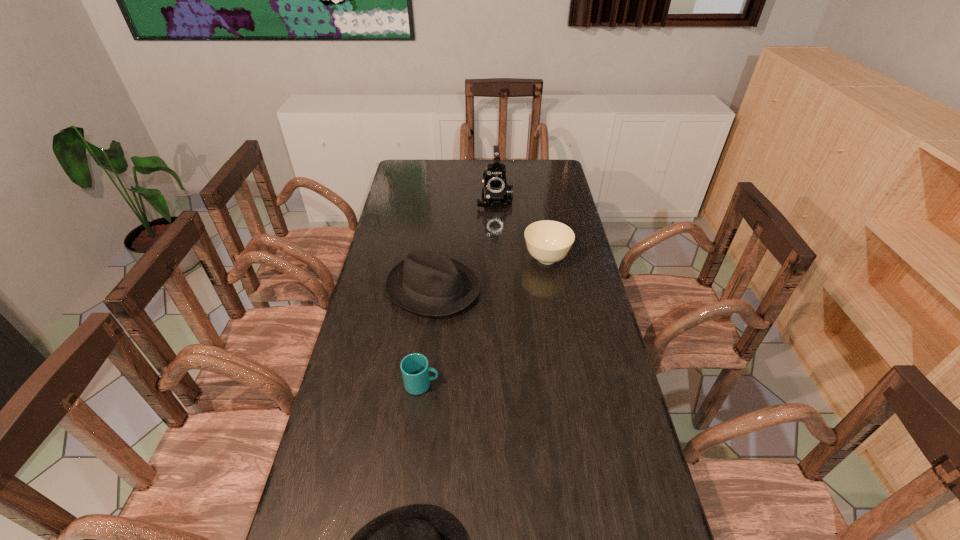
This screenshot has width=960, height=540. I want to click on unoccupied position between the cup and the third tallest object, so 484,321.

Where is `free space between the fourth shortest object and the cup`? The image size is (960, 540). free space between the fourth shortest object and the cup is located at coordinates (427, 336).

Find the location of a particular element. vacant space that's between the taller fedora and the camcorder is located at coordinates (464, 244).

Image resolution: width=960 pixels, height=540 pixels. Find the location of `object that is the closest to the nearest object`. object that is the closest to the nearest object is located at coordinates (415, 369).

Identify which object is located as the nearest to the third tallest object. Please provide its 2D coordinates. Your answer should be formatted as a tuple, i.e. [(x, y)], where the tuple contains the x and y coordinates of a point satisfying the conditions above.

[(427, 281)]

I want to click on free region that satisfies the following two spatial constraints: 1. on the lens mount of the tallest object; 2. on the right side of the rightmost object, so click(497, 259).

Where is `vacant position in the image that satisfies the following two spatial constraints: 1. on the lens mount of the camcorder; 2. on the left side of the third shortest object`? The image size is (960, 540). vacant position in the image that satisfies the following two spatial constraints: 1. on the lens mount of the camcorder; 2. on the left side of the third shortest object is located at coordinates (497, 259).

You are a GUI agent. You are given a task and a screenshot of the screen. Output one action in this format:
    pyautogui.click(x=<x>, y=<y>)
    Task: Click on the free region that satisfies the following two spatial constraints: 1. on the lens mount of the farthest object; 2. on the handle side of the second nearest object
    This screenshot has height=540, width=960.
    Given the screenshot: What is the action you would take?
    pyautogui.click(x=503, y=384)